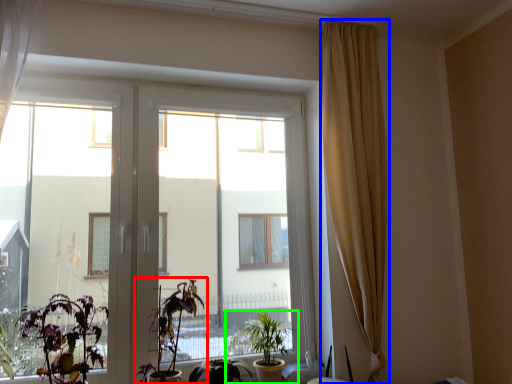
Question: Which object is the farthest from houseplant (highlighted by a red box)? Choose among these: curtain (highlighted by a blue box) or houseplant (highlighted by a green box).

Choices:
 (A) curtain
 (B) houseplant

Answer: (A)